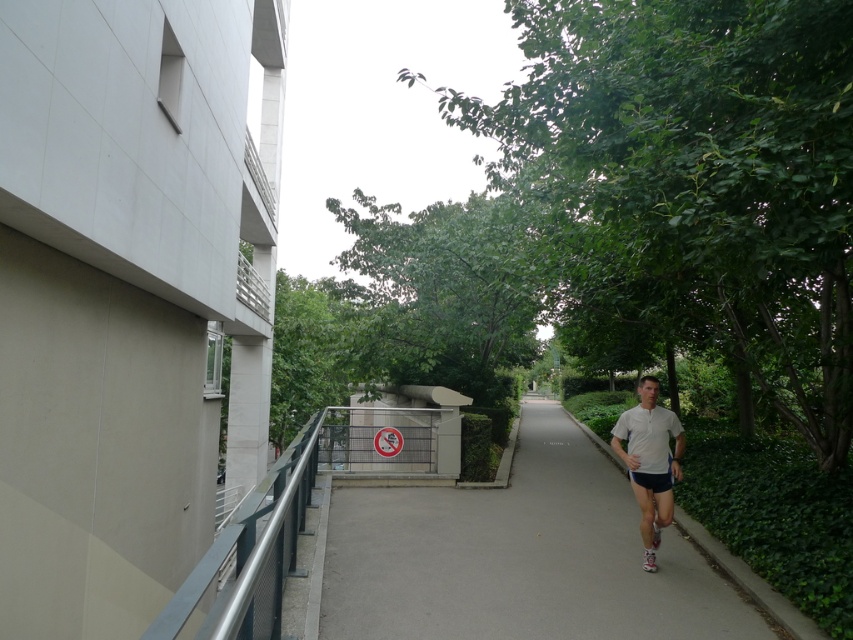
Question: Which point is closer to the camera?

Choices:
 (A) gray asphalt pavement at center
 (B) white matte shirt at center

Answer: (A)

Question: Can you confirm if gray asphalt pavement at center is smaller than white matte shirt at center?

Choices:
 (A) no
 (B) yes

Answer: (A)

Question: Can you confirm if gray asphalt pavement at center is smaller than white matte shirt at center?

Choices:
 (A) yes
 (B) no

Answer: (B)

Question: Is the position of gray asphalt pavement at center more distant than that of white matte shirt at center?

Choices:
 (A) yes
 (B) no

Answer: (B)